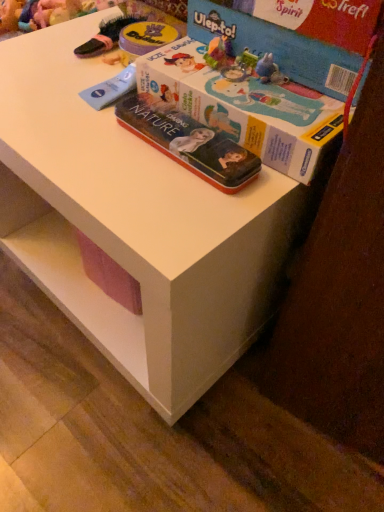
Find the location of `free space to the left of metallic tin box at center`. free space to the left of metallic tin box at center is located at coordinates (72, 135).